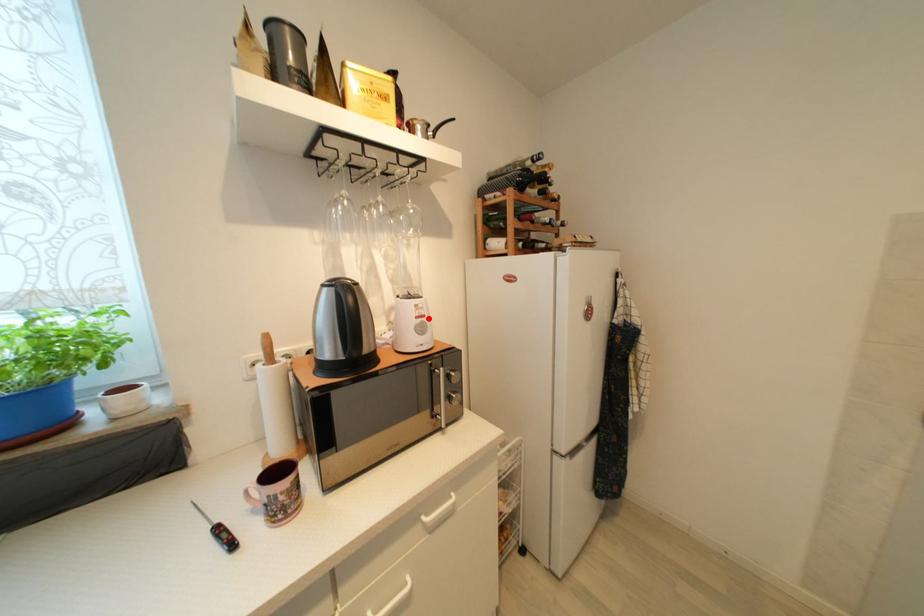
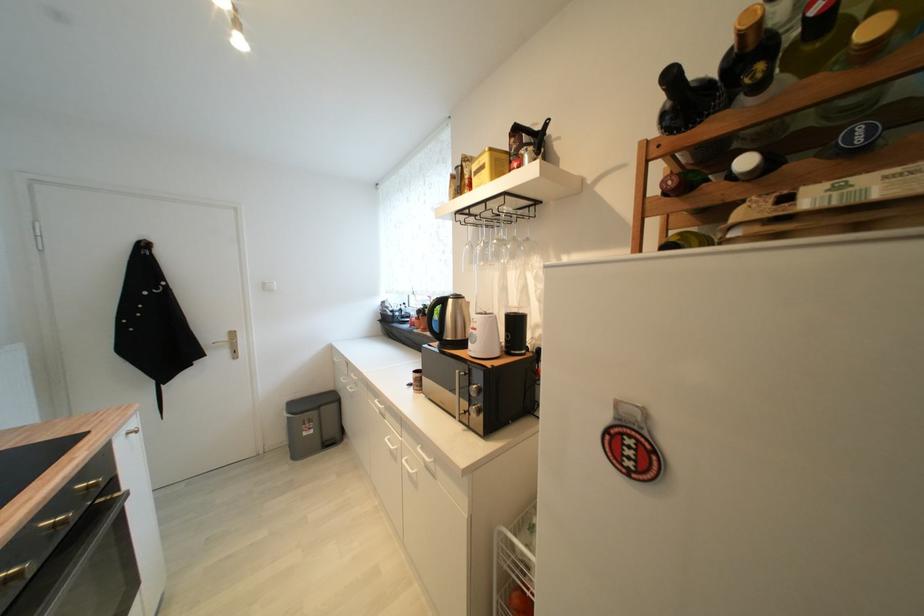
The point at the highlighted location is marked in the first image. Where is the corresponding point in the second image?

(480, 331)